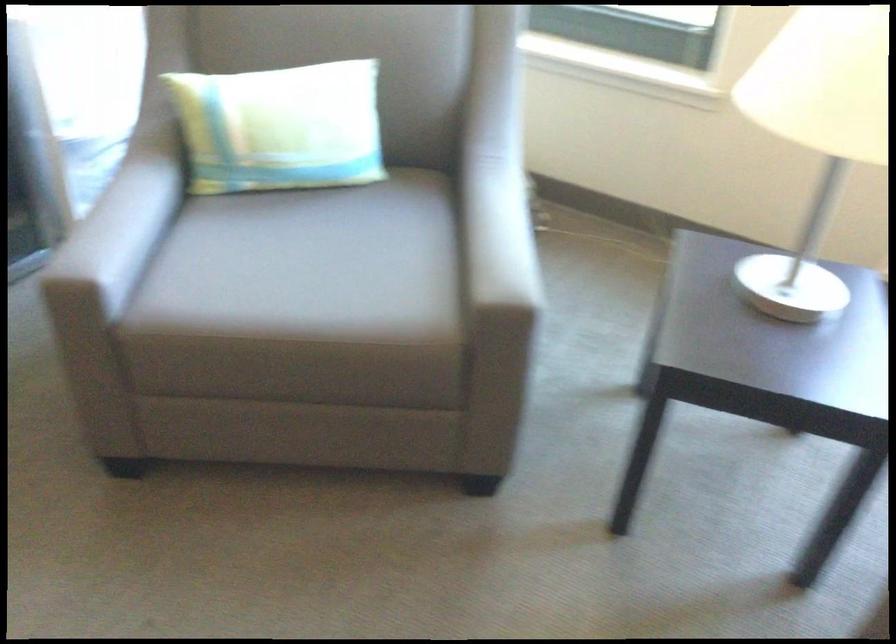
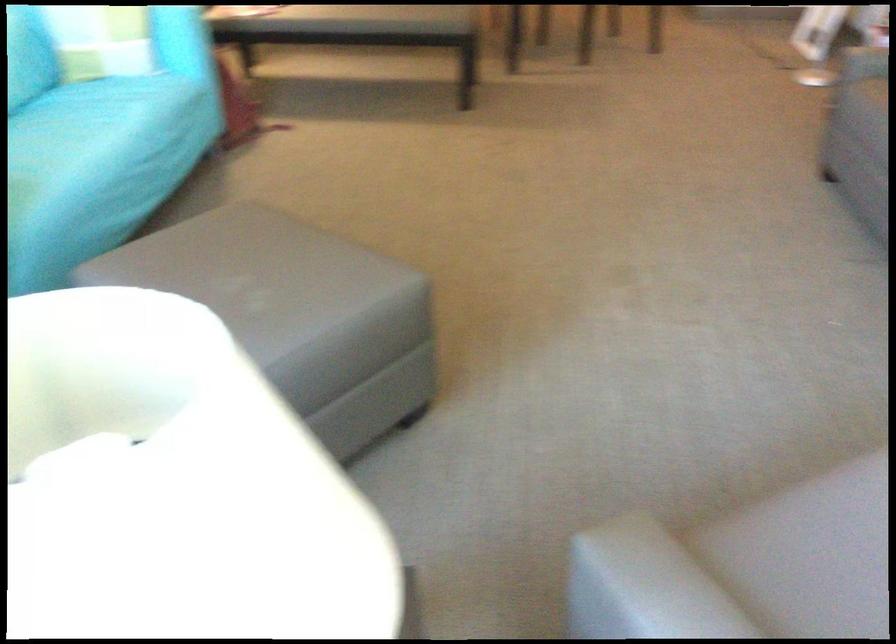
The point at (496,275) is marked in the first image. Where is the corresponding point in the second image?

(665, 583)